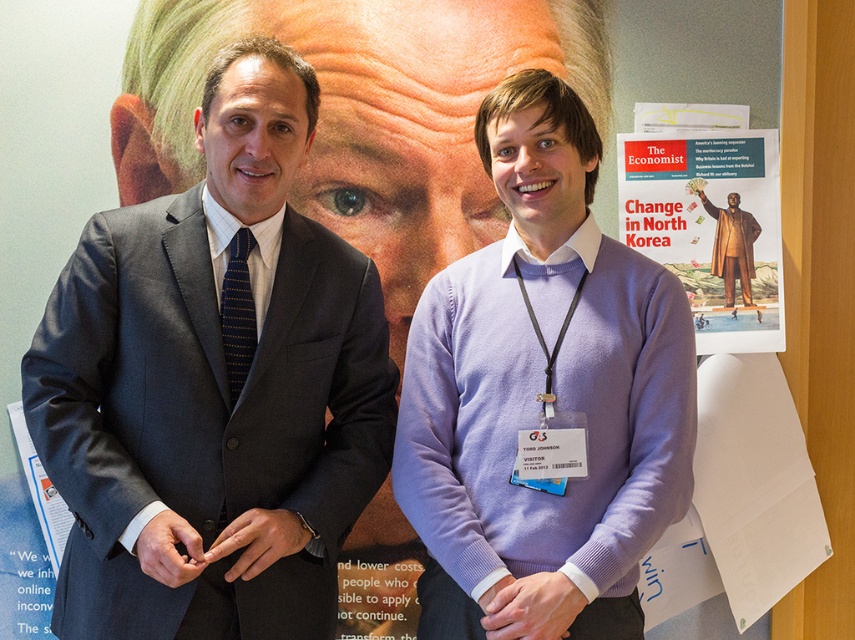
Consider the image. You are a photographer standing 2 meters away from the purple sweater at center. You want to take a photo of the poster in the background without the individuals in the frame. Can you step back further to ensure the individuals are out of the shot?

The purple sweater at center and the camera are 1.39 meters apart. Since you are already 2 meters away from the purple sweater at center, stepping back further would increase the distance between you and the individuals, potentially allowing you to frame the poster without them in the shot. However, the exact feasibility depends on the camera lens and available space, but the current distance suggests it might be possible with adjustment.

You are an event organizer who needs to ensure that the dark gray wool suit at left and the gold metallic statue at center can fit side by side on a 1.8 meter wide display table. Based on the scene description, will they fit?

The dark gray wool suit at left has a larger width than the gold metallic statue at center. However, without knowing the exact widths of both items, it is impossible to determine if their combined width exceeds 1.8 meters. Additional measurements are required to confirm.